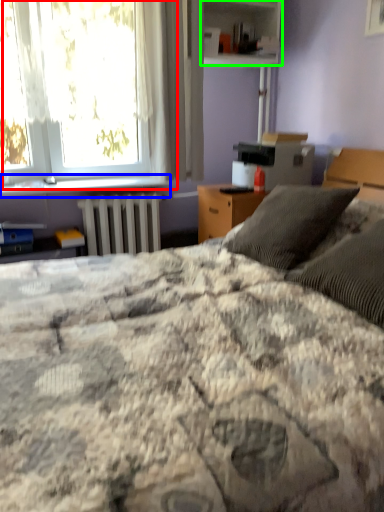
Question: Which object is positioned closest to window (highlighted by a red box)? Select from window sill (highlighted by a blue box) and shelf (highlighted by a green box).

Choices:
 (A) window sill
 (B) shelf

Answer: (A)